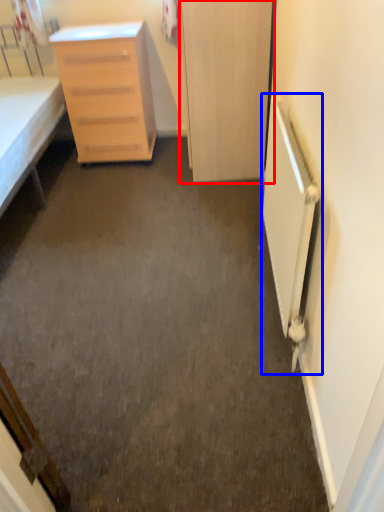
Question: Which object appears closest to the camera in this image, door (highlighted by a red box) or radiator (highlighted by a blue box)?

Choices:
 (A) door
 (B) radiator

Answer: (B)